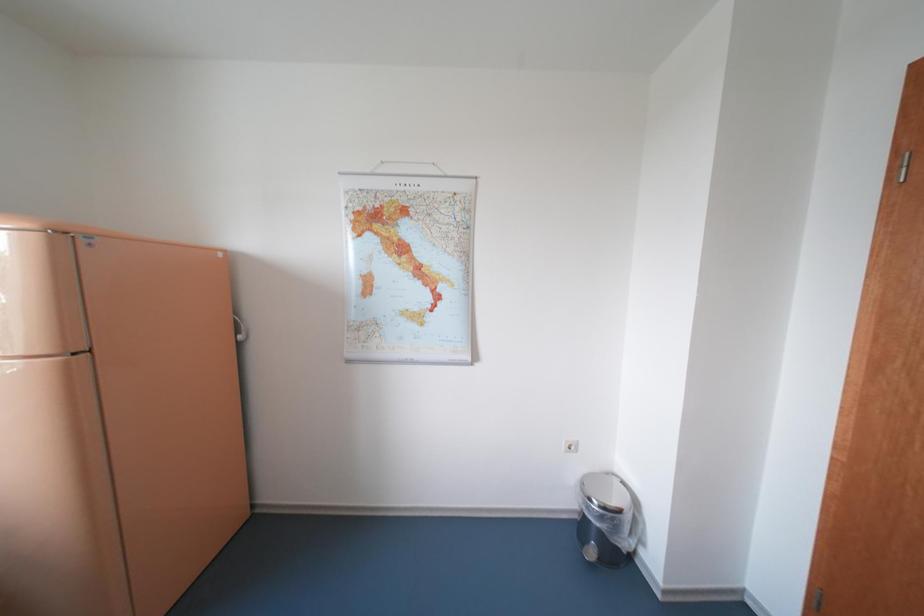
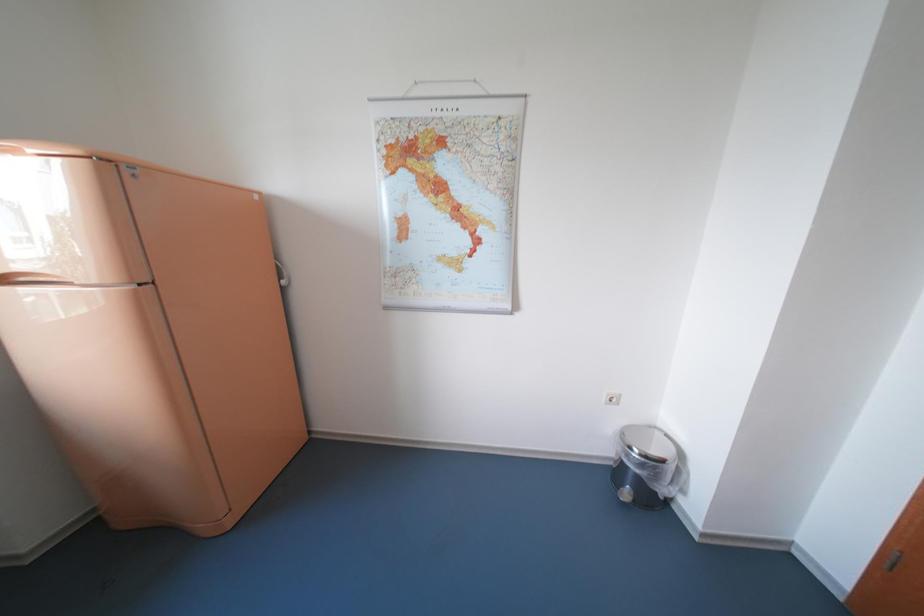
Question: How did the camera likely rotate?

Choices:
 (A) Left
 (B) Right
 (C) Up
 (D) Down

Answer: (D)